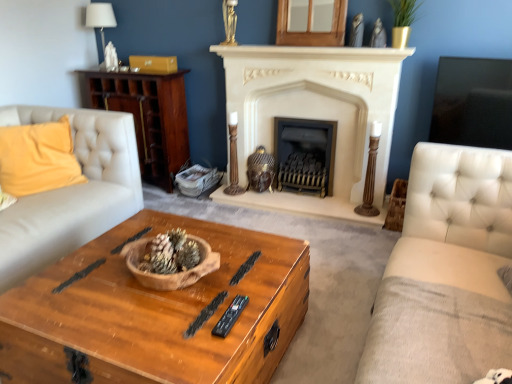
Find the location of `wooden cabinet at left`. wooden cabinet at left is located at coordinates (149, 117).

The height and width of the screenshot is (384, 512). What do you see at coordinates (230, 316) in the screenshot?
I see `black plastic remote at center` at bounding box center [230, 316].

I want to click on white fabric lampshade at upper left, so click(100, 18).

The height and width of the screenshot is (384, 512). What do you see at coordinates (156, 313) in the screenshot? I see `wooden chest at center` at bounding box center [156, 313].

Locate an element on the screen. wooden cabinet at left is located at coordinates (149, 117).

Considering the sizes of objects brown textured pine cone at center and yellow fabric pillow at left in the image provided, who is wider, brown textured pine cone at center or yellow fabric pillow at left?

Wider between the two is yellow fabric pillow at left.

Which object is positioned more to the right, brown textured pine cone at center or yellow fabric pillow at left?

From the viewer's perspective, brown textured pine cone at center appears more on the right side.

From a real-world perspective, between brown textured pine cone at center and yellow fabric pillow at left, who is vertically lower?

brown textured pine cone at center.

How much distance is there between brown textured pine cone at center and yellow fabric pillow at left?

1.41 meters.

Does yellow fabric pillow at left have a greater width compared to wooden cabinet at left?

Incorrect, the width of yellow fabric pillow at left does not surpass that of wooden cabinet at left.

Are yellow fabric pillow at left and wooden cabinet at left located far from each other?

yellow fabric pillow at left is actually quite close to wooden cabinet at left.

Considering the relative sizes of yellow fabric pillow at left and wooden cabinet at left in the image provided, is yellow fabric pillow at left smaller than wooden cabinet at left?

Correct, yellow fabric pillow at left occupies less space than wooden cabinet at left.

From the picture: Between white tufted fabric studio couch at right and brown textured pine cone at center, which one has more height?

white tufted fabric studio couch at right is taller.

Considering the relative positions of white tufted fabric studio couch at right and brown textured pine cone at center in the image provided, is white tufted fabric studio couch at right in front of brown textured pine cone at center?

Yes, it is.

Are wooden chest at center and black plastic remote at center far apart?

No, wooden chest at center is not far from black plastic remote at center.

From the picture: Is wooden chest at center turned away from black plastic remote at center?

No, wooden chest at center's orientation is not away from black plastic remote at center.

From the image's perspective, is wooden chest at center on black plastic remote at center?

Incorrect, from the image's perspective, wooden chest at center is lower than black plastic remote at center.

From a real-world perspective, is wooden chest at center positioned above or below black plastic remote at center?

Clearly, from a real-world perspective, wooden chest at center is below black plastic remote at center.

Looking at this image, is wooden chest at center oriented towards wooden cabinet at left?

No.

Locate an element on the screen. This screenshot has height=384, width=512. cabinetry that is on the left side of wooden chest at center is located at coordinates (149, 117).

Measure the distance between wooden chest at center and wooden cabinet at left.

1.81 meters.

Between wooden chest at center and wooden cabinet at left, which one has smaller size?

Smaller between the two is wooden cabinet at left.

Is black plastic remote at center inside or outside of yellow fabric pillow at left?

black plastic remote at center exists outside the volume of yellow fabric pillow at left.

Where is `pillow on the left of black plastic remote at center`? This screenshot has height=384, width=512. pillow on the left of black plastic remote at center is located at coordinates (38, 158).

Which is more to the right, black plastic remote at center or yellow fabric pillow at left?

Positioned to the right is black plastic remote at center.

Looking at this image, measure the distance from black plastic remote at center to yellow fabric pillow at left.

They are 1.82 meters apart.

Considering the sizes of objects black plastic remote at center and white stone fireplace at center, marked as the first fireplace in a left-to-right arrangement, in the image provided, who is wider, black plastic remote at center or white stone fireplace at center, marked as the first fireplace in a left-to-right arrangement,?

Wider between the two is black plastic remote at center.

Is white stone fireplace at center, which appears as the second fireplace when viewed from the right, surrounded by black plastic remote at center?

No, white stone fireplace at center, which appears as the second fireplace when viewed from the right, is not inside black plastic remote at center.

From the image's perspective, is black plastic remote at center on top of white stone fireplace at center, which appears as the second fireplace when viewed from the right?

Incorrect, from the image's perspective, black plastic remote at center is lower than white stone fireplace at center, which appears as the second fireplace when viewed from the right.

The height and width of the screenshot is (384, 512). In order to click on pine cone lying in front of the yellow fabric pillow at left in this screenshot , I will do `click(170, 253)`.

Locate an element on the screen. This screenshot has height=384, width=512. cabinetry behind the yellow fabric pillow at left is located at coordinates (149, 117).

Based on their spatial positions, is white tufted fabric studio couch at right or white stone fireplace at center, marked as the first fireplace in a left-to-right arrangement, further from yellow fabric pillow at left?

Based on the image, white tufted fabric studio couch at right appears to be further to yellow fabric pillow at left.

In the scene shown: When comparing their distances from black metal fireplace at center, the second fireplace positioned from the left, does brown textured pine cone at center or wooden cabinet at left seem further?

Among the two, brown textured pine cone at center is located further to black metal fireplace at center, the second fireplace positioned from the left.

Based on their spatial positions, is wooden cabinet at left or yellow fabric pillow at left further from white stone fireplace at center, which appears as the second fireplace when viewed from the right?

yellow fabric pillow at left.

When comparing their distances from white stone fireplace at center, marked as the first fireplace in a left-to-right arrangement, does wooden chest at center or white fabric lampshade at upper left seem further?

The object further to white stone fireplace at center, marked as the first fireplace in a left-to-right arrangement, is white fabric lampshade at upper left.

From the picture: Which object lies nearer to the anchor point black plastic remote at center, wooden cabinet at left or wooden chest at center?

wooden chest at center lies closer to black plastic remote at center than the other object.

Which object lies further to the anchor point black metal fireplace at center, acting as the first fireplace starting from the right, brown textured pine cone at center or yellow fabric pillow at left?

Among the two, brown textured pine cone at center is located further to black metal fireplace at center, acting as the first fireplace starting from the right.

Estimate the real-world distances between objects in this image. Which object is further from black plastic remote at center, brown textured pine cone at center or black metal fireplace at center, the second fireplace positioned from the left?

Based on the image, black metal fireplace at center, the second fireplace positioned from the left, appears to be further to black plastic remote at center.

Consider the image. Estimate the real-world distances between objects in this image. Which object is further from white fabric lampshade at upper left, white tufted fabric studio couch at right or white stone fireplace at center, marked as the first fireplace in a left-to-right arrangement?

Based on the image, white tufted fabric studio couch at right appears to be further to white fabric lampshade at upper left.

This screenshot has width=512, height=384. In order to click on pine cone between white tufted fabric studio couch at right and wooden cabinet at left in the front-back direction in this screenshot , I will do `click(170, 253)`.

This screenshot has width=512, height=384. Find the location of `coffee table between white tufted fabric studio couch at right and wooden cabinet at left along the z-axis`. coffee table between white tufted fabric studio couch at right and wooden cabinet at left along the z-axis is located at coordinates click(x=156, y=313).

Where is `remote between wooden chest at center and brown textured pine cone at center in the front-back direction`? The image size is (512, 384). remote between wooden chest at center and brown textured pine cone at center in the front-back direction is located at coordinates (230, 316).

At what (x,y) coordinates should I click in order to perform the action: click on pillow between brown textured pine cone at center and white fabric lampshade at upper left from front to back. Please return your answer as a coordinate pair (x, y). The width and height of the screenshot is (512, 384). Looking at the image, I should click on point(38,158).